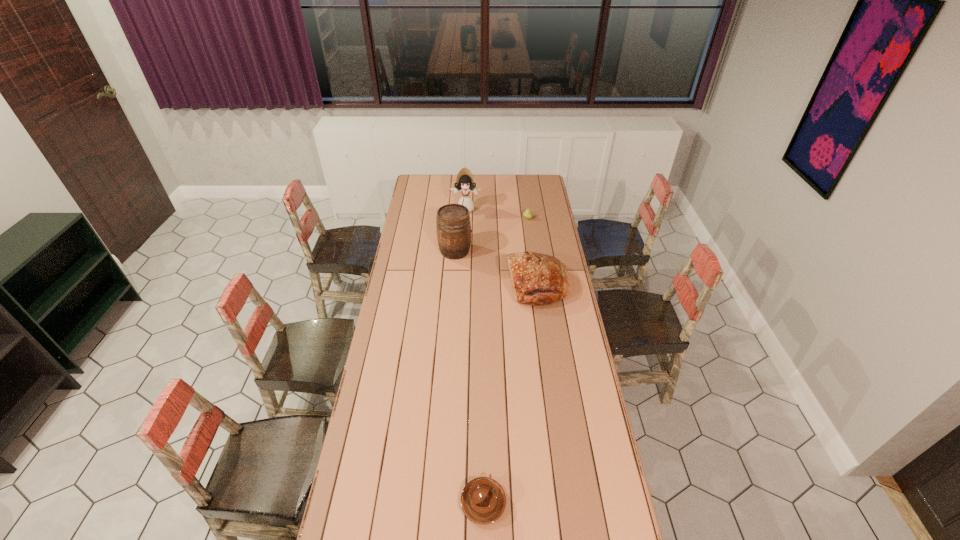
The image size is (960, 540). What are the coordinates of `vacant space at the left edge of the desktop` in the screenshot? It's located at (358, 483).

In the image, there is a desktop. Where is `free space at the right edge`? This screenshot has height=540, width=960. free space at the right edge is located at coordinates (531, 202).

Image resolution: width=960 pixels, height=540 pixels. In the image, there is a desktop. Identify the location of vacant area at the far right corner. (526, 187).

Find the location of `empty space between the shortest object and the bread`. empty space between the shortest object and the bread is located at coordinates (510, 394).

Locate an element on the screen. empty space that is in between the fourth farthest object and the cider is located at coordinates (496, 268).

Locate an element on the screen. vacant space that's between the third tallest object and the pear is located at coordinates (533, 252).

At what (x,y) coordinates should I click in order to perform the action: click on vacant point located between the fourth farthest object and the doll. Please return your answer as a coordinate pair (x, y). Looking at the image, I should click on (501, 247).

The width and height of the screenshot is (960, 540). I want to click on vacant space that's between the fourth farthest object and the farthest object, so click(501, 247).

Image resolution: width=960 pixels, height=540 pixels. Find the location of `empty space between the doll and the fourth farthest object`. empty space between the doll and the fourth farthest object is located at coordinates (501, 247).

You are a GUI agent. You are given a task and a screenshot of the screen. Output one action in this format:
    pyautogui.click(x=<x>, y=<y>)
    Task: Click on the free space between the shortest object and the cider
    This screenshot has width=960, height=540.
    Given the screenshot: What is the action you would take?
    pyautogui.click(x=469, y=377)